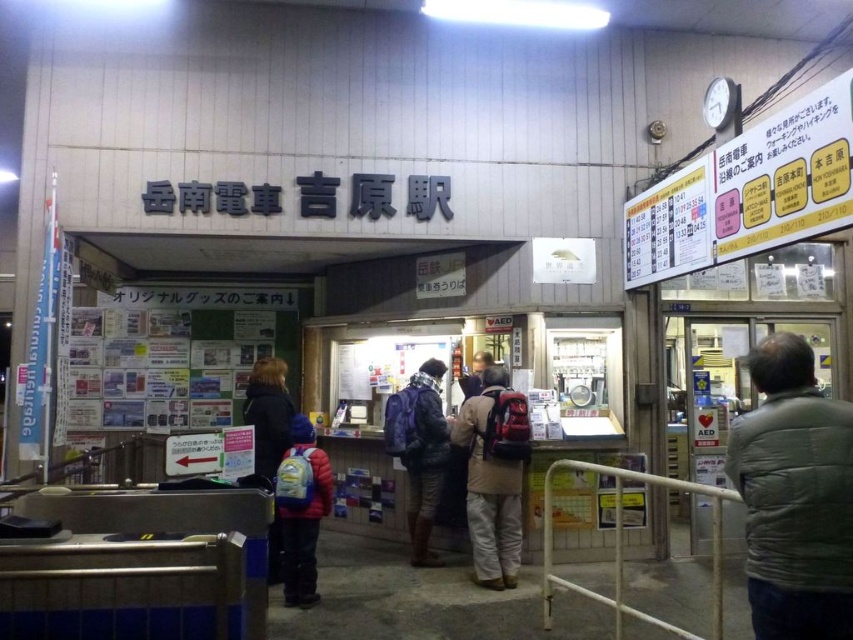
You are standing at the entrance of Yamanen Dentetsu Yoshigahara Station and want to locate the green quilted jacket at right. According to the coordinates provided, where exactly should you look to find it?

The green quilted jacket at right is located at coordinates point (793, 497), which is towards the lower right corner of the entrance area.